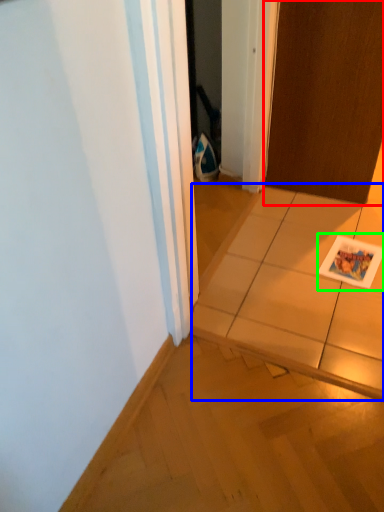
Question: Which object is positioned farthest from door (highlighted by a red box)? Select from tile (highlighted by a blue box) and postcard (highlighted by a green box).

Choices:
 (A) tile
 (B) postcard

Answer: (A)